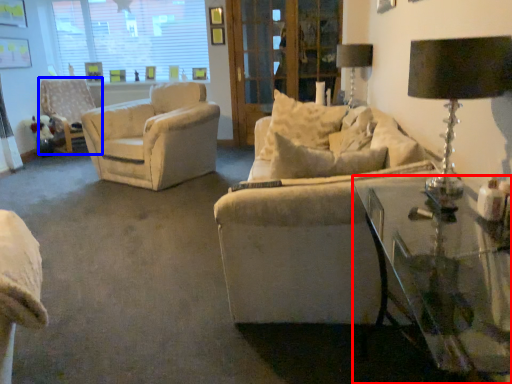
Question: Which object is further to the camera taking this photo, table (highlighted by a red box) or chair (highlighted by a blue box)?

Choices:
 (A) table
 (B) chair

Answer: (B)